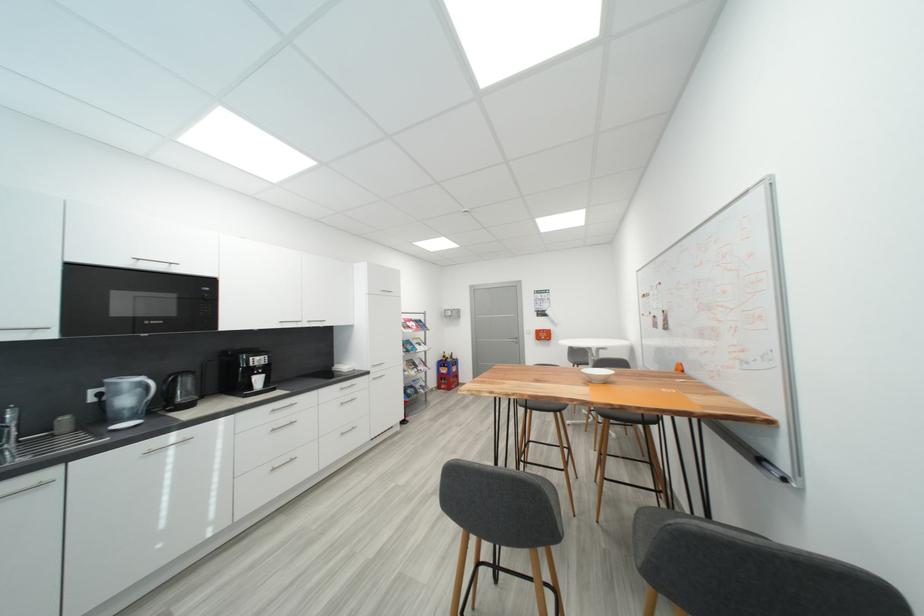
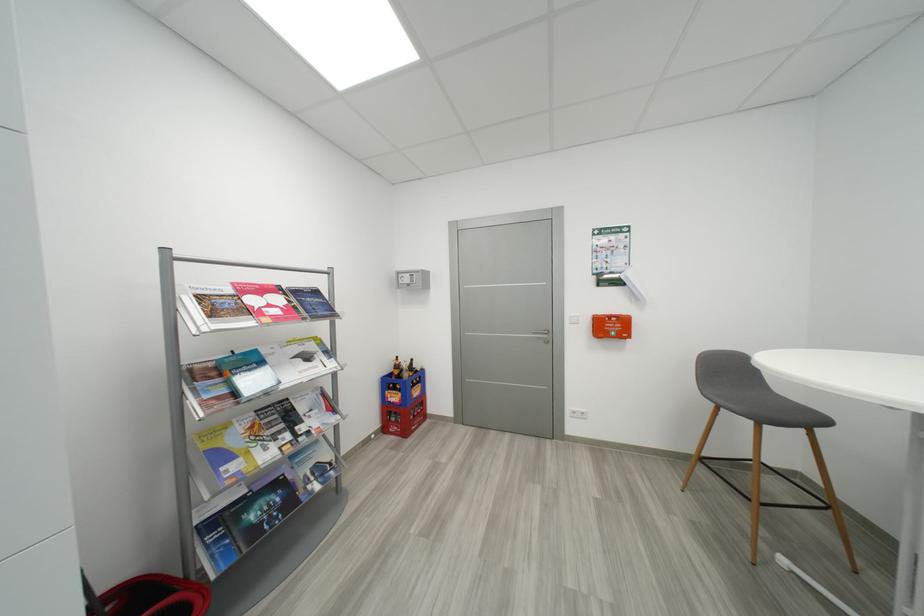
Where in the second image is the point corresponding to (419,389) from the first image?

(285, 485)